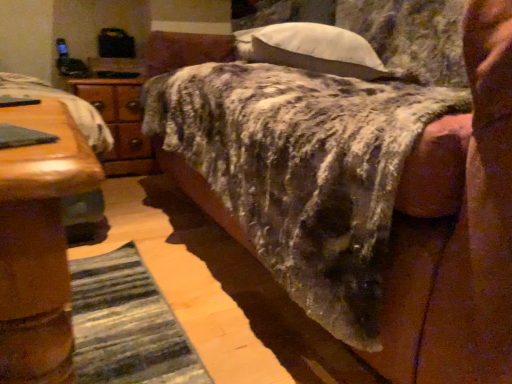
Question: Is textured wool blanket at center completely or partially outside of white soft pillow at upper center?

Choices:
 (A) no
 (B) yes

Answer: (B)

Question: From a real-world perspective, is textured wool blanket at center positioned over white soft pillow at upper center based on gravity?

Choices:
 (A) no
 (B) yes

Answer: (A)

Question: Can you confirm if textured wool blanket at center is shorter than white soft pillow at upper center?

Choices:
 (A) yes
 (B) no

Answer: (B)

Question: Is textured wool blanket at center positioned with its back to white soft pillow at upper center?

Choices:
 (A) yes
 (B) no

Answer: (A)

Question: Can you confirm if textured wool blanket at center is bigger than white soft pillow at upper center?

Choices:
 (A) no
 (B) yes

Answer: (B)

Question: Considering the positions of textured wool blanket at center and wooden nightstand at left in the image, is textured wool blanket at center wider or thinner than wooden nightstand at left?

Choices:
 (A) thin
 (B) wide

Answer: (B)

Question: Would you say textured wool blanket at center is to the left or to the right of wooden nightstand at left in the picture?

Choices:
 (A) right
 (B) left

Answer: (A)

Question: Considering their positions, is textured wool blanket at center located in front of or behind wooden nightstand at left?

Choices:
 (A) behind
 (B) front

Answer: (B)

Question: Considering the positions of textured wool blanket at center and wooden nightstand at left in the image, is textured wool blanket at center bigger or smaller than wooden nightstand at left?

Choices:
 (A) big
 (B) small

Answer: (A)

Question: Would you say wooden nightstand at left is to the left or to the right of white soft pillow at upper center in the picture?

Choices:
 (A) right
 (B) left

Answer: (B)

Question: Does point 115,109 appear closer or farther from the camera than point 350,39?

Choices:
 (A) closer
 (B) farther

Answer: (B)

Question: From the image's perspective, relative to white soft pillow at upper center, is wooden nightstand at left above or below?

Choices:
 (A) below
 (B) above

Answer: (A)

Question: In the image, is wooden nightstand at left positioned in front of or behind white soft pillow at upper center?

Choices:
 (A) front
 (B) behind

Answer: (B)

Question: In the image, is textured wool blanket at center positioned in front of or behind white soft pillow at upper center?

Choices:
 (A) behind
 (B) front

Answer: (B)

Question: Considering the positions of textured wool blanket at center and white soft pillow at upper center in the image, is textured wool blanket at center bigger or smaller than white soft pillow at upper center?

Choices:
 (A) big
 (B) small

Answer: (A)